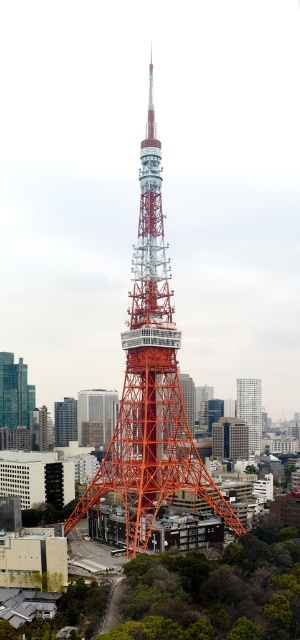
Does orange metallic tower at center appear on the right side of white glass building at center-right?

No, orange metallic tower at center is not to the right of white glass building at center-right.

Which of these two, orange metallic tower at center or white glass building at center-right, stands taller?

orange metallic tower at center

Locate an element on the screen. The height and width of the screenshot is (640, 300). orange metallic tower at center is located at coordinates (150, 385).

Locate an element on the screen. orange metallic tower at center is located at coordinates (150, 385).